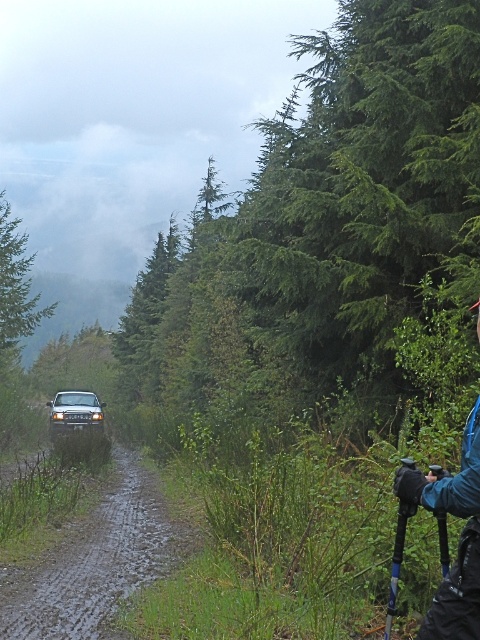
Between point (75, 520) and point (79, 429), which one is positioned behind?

Point (79, 429)

Can you confirm if muddy dirt road at left is positioned below shiny silver suv at center?

Incorrect, muddy dirt road at left is not positioned below shiny silver suv at center.

Find the location of `muddy dirt road at left`. muddy dirt road at left is located at coordinates click(x=96, y=561).

The image size is (480, 640). Identify the location of muddy dirt road at left. (96, 561).

Can you confirm if muddy dirt road at left is taller than blue fabric camera at lower right?

Indeed, muddy dirt road at left has a greater height compared to blue fabric camera at lower right.

Is point (41, 609) closer to viewer compared to point (429, 404)?

That is True.

This screenshot has width=480, height=640. What are the coordinates of `muddy dirt road at left` in the screenshot? It's located at (96, 561).

Who is higher up, blue fabric camera at lower right or shiny silver suv at center?

blue fabric camera at lower right is higher up.

Does blue fabric camera at lower right have a larger size compared to shiny silver suv at center?

No.

This screenshot has width=480, height=640. In order to click on blue fabric camera at lower right in this screenshot , I will do click(x=444, y=536).